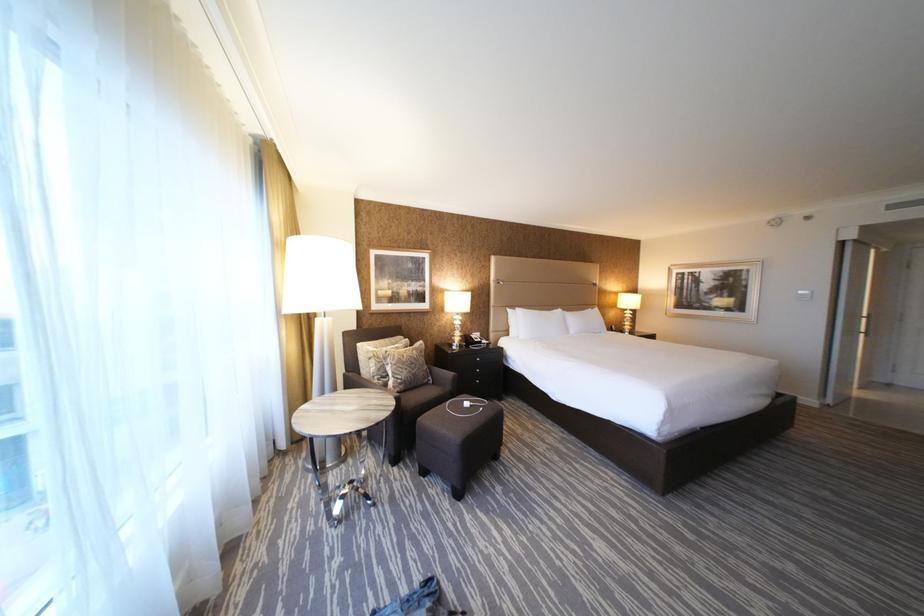
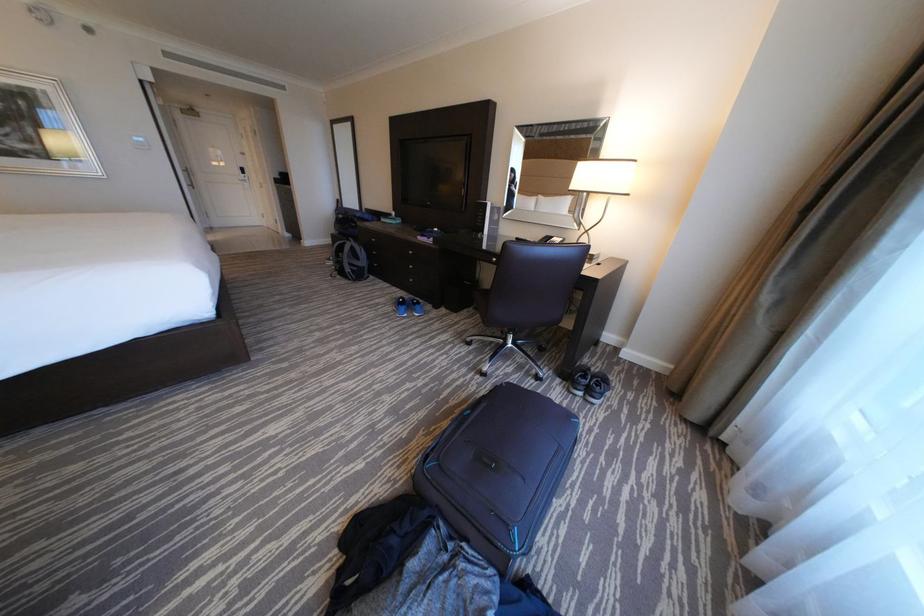
The first image is from the beginning of the video and the second image is from the end. How did the camera likely rotate when shooting the video?

The camera rotated toward right-down.